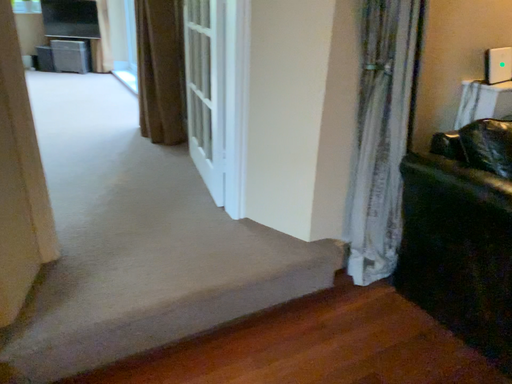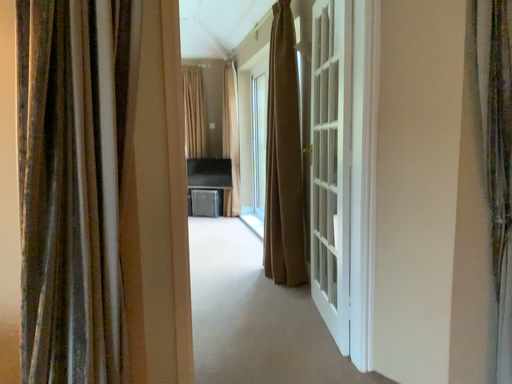
Question: Which way did the camera rotate in the video?

Choices:
 (A) rotated right
 (B) rotated left

Answer: (B)